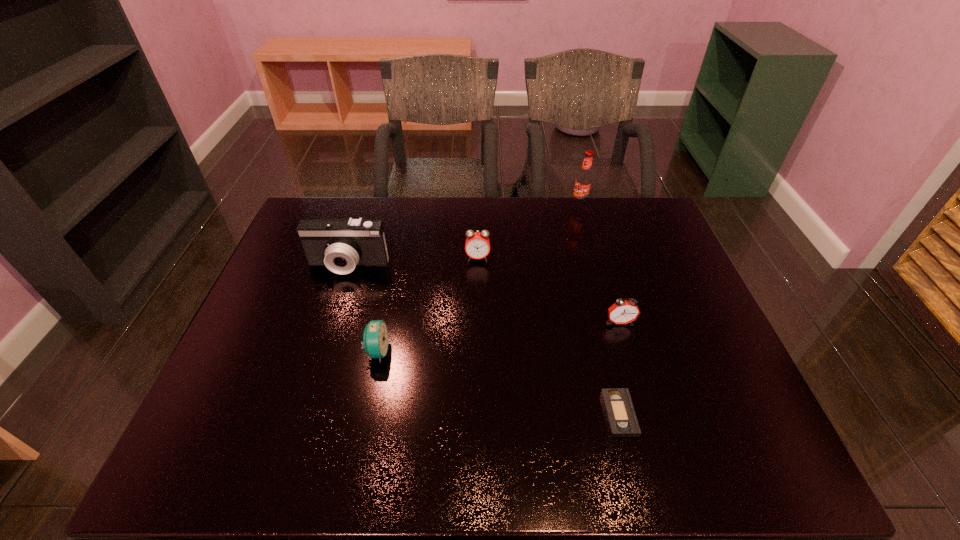
This screenshot has width=960, height=540. What are the coordinates of `root beer` in the screenshot? It's located at (584, 180).

Where is `the tallest object`? The width and height of the screenshot is (960, 540). the tallest object is located at coordinates click(x=584, y=180).

Image resolution: width=960 pixels, height=540 pixels. I want to click on camcorder, so point(339,244).

The height and width of the screenshot is (540, 960). Find the location of `the fourth object from right to left`. the fourth object from right to left is located at coordinates (477, 246).

I want to click on the second alarm clock from right to left, so [x=477, y=246].

Find the location of a particular element. the leftmost alarm clock is located at coordinates [375, 342].

Where is `the second nearest object`? The height and width of the screenshot is (540, 960). the second nearest object is located at coordinates (375, 342).

The image size is (960, 540). I want to click on the third nearest object, so click(622, 311).

The width and height of the screenshot is (960, 540). Identify the location of the second nearest alarm clock. (622, 311).

The image size is (960, 540). I want to click on the shortest object, so click(622, 421).